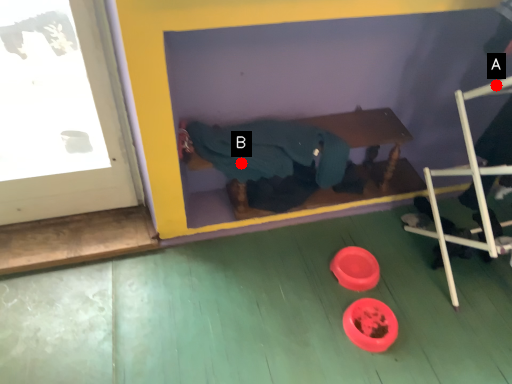
Question: Two points are circled on the image, labeled by A and B beside each circle. Which of the following is the farthest from the observer?

Choices:
 (A) A is further
 (B) B is further

Answer: (A)